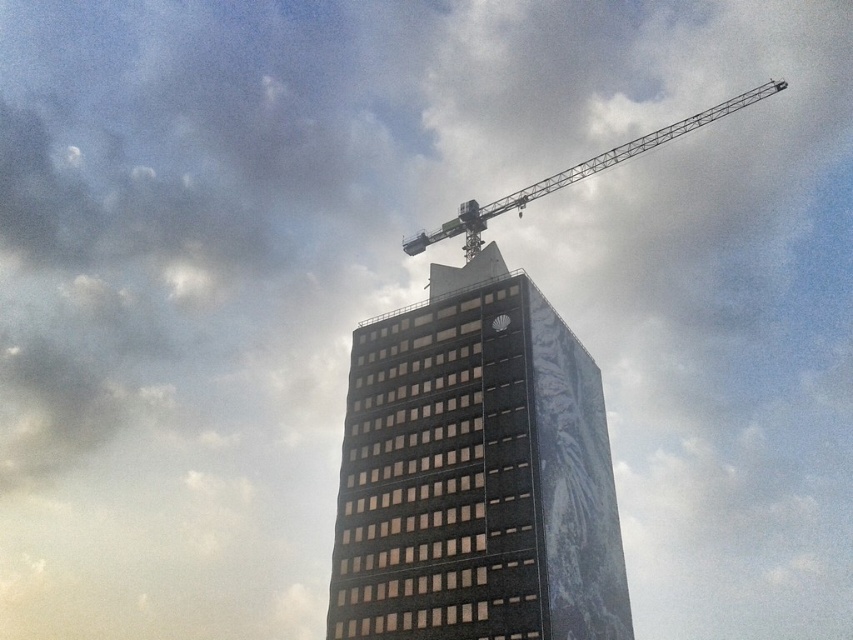
You are an architect reviewing the construction site. You need to determine if the black glass building at center will fit within the designated plot area. The plot area has a maximum width of 50 meters. According to the crane operator, the metallic gray crane at upper right is 60 meters wide. Can the building be safely constructed within the plot area?

The black glass building at center has a lesser width compared to the metallic gray crane at upper right, which is 60 meters wide. Since the plot area allows a maximum width of 50 meters, the building must be narrower than the crane. Therefore, the building can be safely constructed within the plot area as its width is under the 50 meters limit.

You are an architect reviewing a construction site. You notice two points marked on the building facade at coordinates point (368, 492) and point (601, 157). Which point is nearer to your current position?

Point (368, 492) is closer to the viewer than point (601, 157), so the first point is nearer to your current position.

You are an architect reviewing construction plans for the black glass building at center and the metallic gray crane at upper right. Based on the current design, which structure appears to be the smaller one in the image?

The black glass building at center is smaller than the metallic gray crane at upper right according to the design.